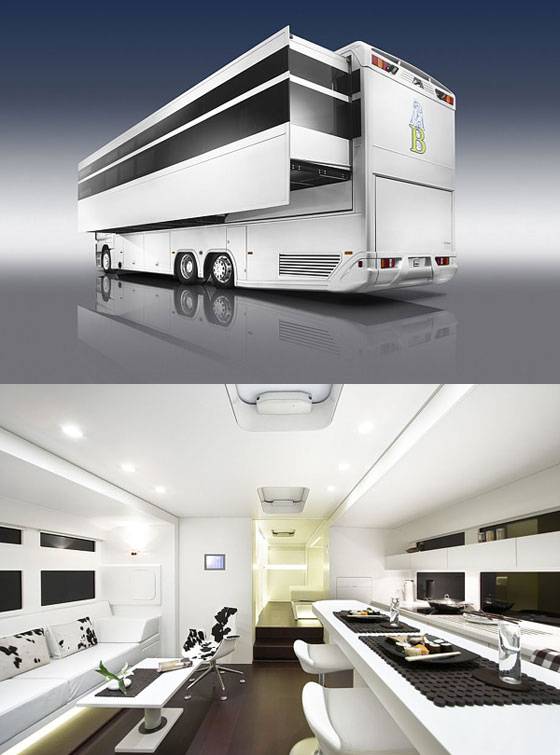
The height and width of the screenshot is (755, 560). What are the coordinates of `place to sleep` in the screenshot? It's located at (305, 590).